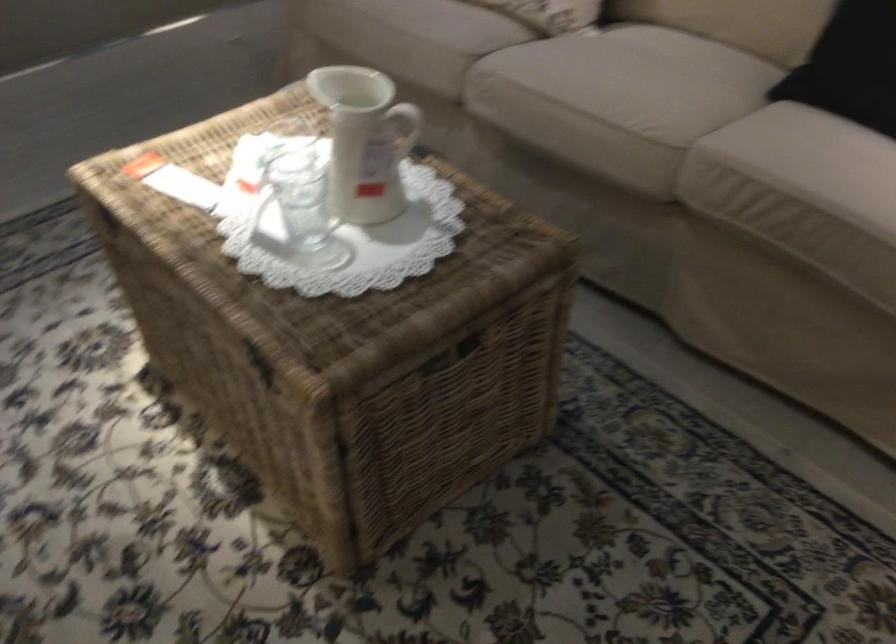
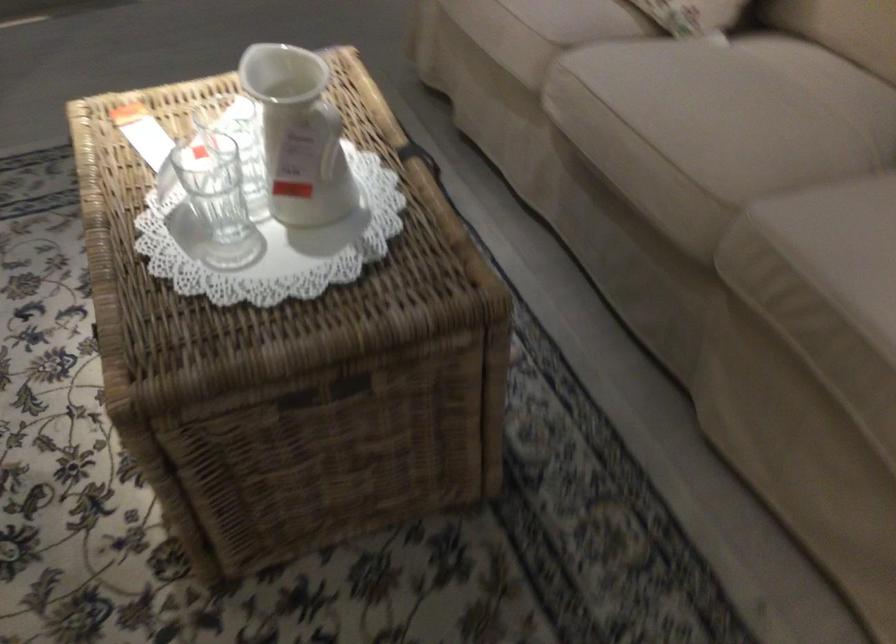
Question: The camera is either moving clockwise (left) or counter-clockwise (right) around the object. The first image is from the beginning of the video and the second image is from the end. Is the camera moving left or right when shooting the video?

Choices:
 (A) Left
 (B) Right

Answer: (B)